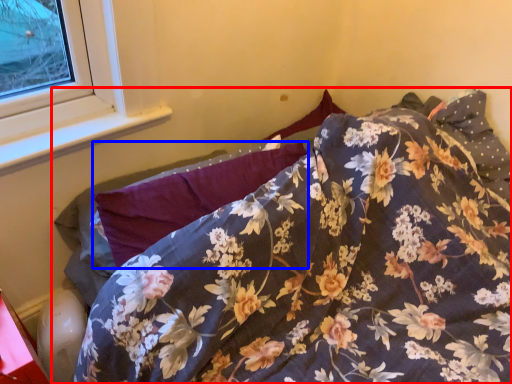
Question: Which point is closer to the camera, bed (highlighted by a red box) or pillow (highlighted by a blue box)?

Choices:
 (A) bed
 (B) pillow

Answer: (A)